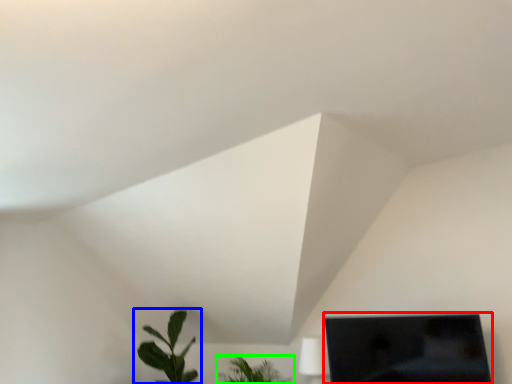
Question: Which object is the closest to the computer monitor (highlighted by a red box)? Choose among these: houseplant (highlighted by a blue box) or houseplant (highlighted by a green box).

Choices:
 (A) houseplant
 (B) houseplant

Answer: (B)